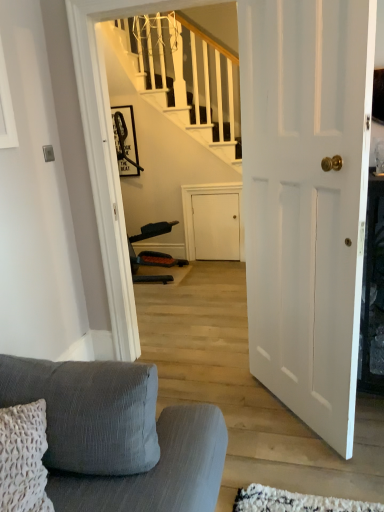
Describe the element at coordinates (119, 437) in the screenshot. I see `textured gray fabric couch at lower left` at that location.

Describe the element at coordinates (306, 200) in the screenshot. I see `white matte door at center` at that location.

Describe the element at coordinates (125, 141) in the screenshot. I see `matte black picture frame at upper center` at that location.

What are the coordinates of `textured gray fabric couch at lower left` in the screenshot? It's located at coord(119,437).

How much distance is there between white matte door at center and textured gray fabric couch at lower left?

white matte door at center and textured gray fabric couch at lower left are 94.60 centimeters apart.

From the image's perspective, is white matte door at center under textured gray fabric couch at lower left?

Incorrect, from the image's perspective, white matte door at center is higher than textured gray fabric couch at lower left.

Who is taller, white matte door at center or textured gray fabric couch at lower left?

white matte door at center.

Is white matte door at center far away from textured gray fabric couch at lower left?

white matte door at center is actually quite close to textured gray fabric couch at lower left.

Locate an element on the screen. studio couch below the matte black picture frame at upper center (from a real-world perspective) is located at coordinates (119, 437).

Does matte black picture frame at upper center touch textured gray fabric couch at lower left?

matte black picture frame at upper center and textured gray fabric couch at lower left are clearly separated.

Does matte black picture frame at upper center have a greater width compared to textured gray fabric couch at lower left?

In fact, matte black picture frame at upper center might be narrower than textured gray fabric couch at lower left.

In the image, is textured gray fabric couch at lower left positioned in front of or behind matte black picture frame at upper center?

textured gray fabric couch at lower left is in front of matte black picture frame at upper center.

From a real-world perspective, is textured gray fabric couch at lower left beneath matte black picture frame at upper center?

Yes, from a real-world perspective, textured gray fabric couch at lower left is under matte black picture frame at upper center.

Is textured gray fabric couch at lower left far from matte black picture frame at upper center?

Yes, textured gray fabric couch at lower left and matte black picture frame at upper center are located far from each other.

Consider the image. Is the surface of textured gray fabric couch at lower left in direct contact with white matte door at center?

They are not placed beside each other.

Consider the image. From their relative heights in the image, would you say textured gray fabric couch at lower left is taller or shorter than white matte door at center?

Considering their sizes, textured gray fabric couch at lower left has less height than white matte door at center.

Measure the distance between textured gray fabric couch at lower left and white matte door at center.

They are 37.24 inches apart.

Looking at the image, does textured gray fabric couch at lower left seem bigger or smaller compared to white matte door at center?

In the image, textured gray fabric couch at lower left appears to be larger than white matte door at center.

Is point (121, 112) closer to camera compared to point (328, 322)?

No, it is behind (328, 322).

Considering the sizes of matte black picture frame at upper center and white matte door at center in the image, is matte black picture frame at upper center taller or shorter than white matte door at center?

In the image, matte black picture frame at upper center appears to be shorter than white matte door at center.

Is matte black picture frame at upper center further to camera compared to white matte door at center?

Yes, matte black picture frame at upper center is further from the viewer.

Locate an element on the screen. Image resolution: width=384 pixels, height=512 pixels. picture frame on the left of the white matte door at center is located at coordinates (125, 141).

Consider the image. How much distance is there between white matte door at center and matte black picture frame at upper center?

white matte door at center is 3.03 meters from matte black picture frame at upper center.

The image size is (384, 512). Identify the location of door below the matte black picture frame at upper center (from the image's perspective). (306, 200).

From the image's perspective, is white matte door at center on top of matte black picture frame at upper center?

No.

In the scene shown: How different are the orientations of white matte door at center and matte black picture frame at upper center in degrees?

white matte door at center and matte black picture frame at upper center are facing 49.7 degrees away from each other.

Locate an element on the screen. This screenshot has width=384, height=512. studio couch in front of the white matte door at center is located at coordinates (119, 437).

The width and height of the screenshot is (384, 512). I want to click on studio couch located underneath the matte black picture frame at upper center (from a real-world perspective), so click(119, 437).

Which object lies nearer to the anchor point white matte door at center, matte black picture frame at upper center or textured gray fabric couch at lower left?

Based on the image, textured gray fabric couch at lower left appears to be nearer to white matte door at center.

Considering their positions, is textured gray fabric couch at lower left positioned closer to matte black picture frame at upper center than white matte door at center?

Among the two, white matte door at center is located nearer to matte black picture frame at upper center.

Consider the image. Which object lies nearer to the anchor point matte black picture frame at upper center, white matte door at center or textured gray fabric couch at lower left?

white matte door at center is closer to matte black picture frame at upper center.

When comparing their distances from textured gray fabric couch at lower left, does white matte door at center or matte black picture frame at upper center seem closer?

white matte door at center.

Looking at this image, considering their positions, is matte black picture frame at upper center positioned closer to textured gray fabric couch at lower left than white matte door at center?

white matte door at center is positioned closer to the anchor textured gray fabric couch at lower left.

Which object lies nearer to the anchor point white matte door at center, textured gray fabric couch at lower left or matte black picture frame at upper center?

Among the two, textured gray fabric couch at lower left is located nearer to white matte door at center.

Locate an element on the screen. door between textured gray fabric couch at lower left and matte black picture frame at upper center from front to back is located at coordinates (306, 200).